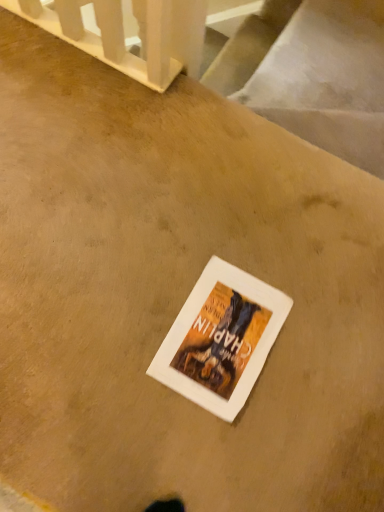
Image resolution: width=384 pixels, height=512 pixels. I want to click on unoccupied space behind white paper book at center, so click(239, 232).